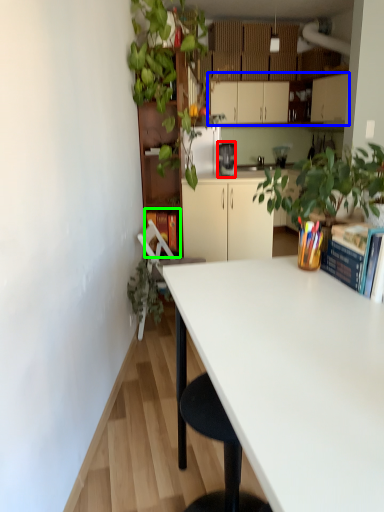
Question: Which is farther away from coffee maker (highlighted by a red box)? cabinetry (highlighted by a blue box) or book (highlighted by a green box)?

Choices:
 (A) cabinetry
 (B) book

Answer: (A)